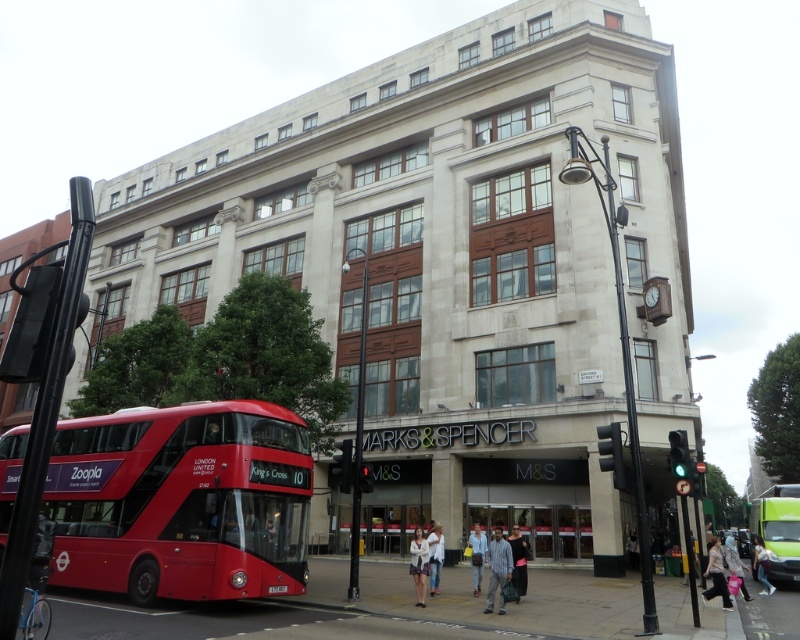
Question: Which point is closer to the camera taking this photo?

Choices:
 (A) (472, 566)
 (B) (6, 461)
 (C) (768, 531)

Answer: (B)

Question: Is plaid shirt at center bigger than white cotton shirt at lower right?

Choices:
 (A) yes
 (B) no

Answer: (B)

Question: Which point appears farthest from the camera in this image?

Choices:
 (A) (486, 605)
 (B) (480, 589)
 (C) (516, 563)

Answer: (B)

Question: Which object is positioned farthest from the light blue jeans at center?

Choices:
 (A) black fabric dress at center
 (B) plaid shirt at center
 (C) matte pink bag at lower right
 (D) white cotton shirt at center

Answer: (C)

Question: Does metallic red bus at lower left appear on the left side of white cotton shirt at lower right?

Choices:
 (A) no
 (B) yes

Answer: (B)

Question: Does plaid shirt at center appear under light blue jeans at center?

Choices:
 (A) no
 (B) yes

Answer: (A)